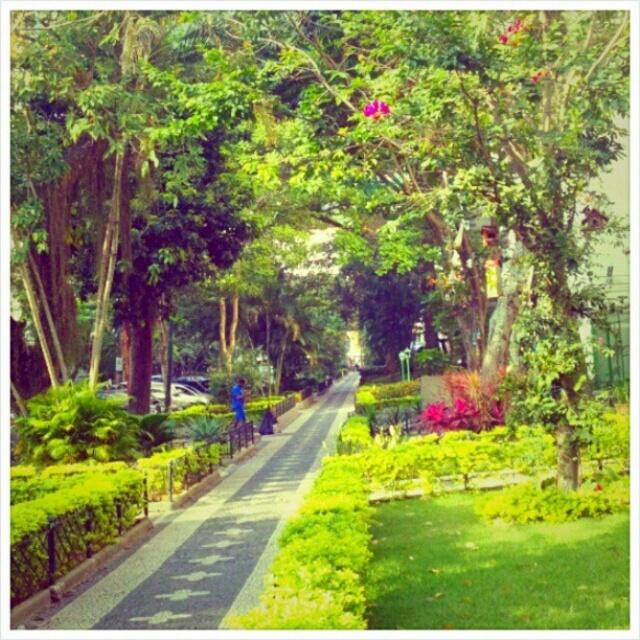
Does green paved walkway at center have a greater height compared to pink matte flower at upper center?

In fact, green paved walkway at center may be shorter than pink matte flower at upper center.

Looking at this image, measure the distance between green paved walkway at center and pink matte flower at upper center.

green paved walkway at center and pink matte flower at upper center are 7.53 meters apart.

Is point (161, 564) positioned in front of point (376, 100)?

Yes, point (161, 564) is closer to viewer.

This screenshot has height=640, width=640. I want to click on green paved walkway at center, so click(x=214, y=536).

Where is `green leafy tree at center`? green leafy tree at center is located at coordinates (337, 150).

Can you confirm if green leafy tree at center is positioned above pink matte flower at upper center?

Indeed, green leafy tree at center is positioned over pink matte flower at upper center.

Who is more forward, (616, 125) or (365, 108)?

Point (365, 108)

Identify the location of green leafy tree at center. (337, 150).

Which is behind, point (179, 68) or point (298, 460)?

The point (298, 460) is more distant.

Is point (506, 266) more distant than point (184, 520)?

Yes, it is.

The image size is (640, 640). I want to click on green leafy tree at center, so click(337, 150).